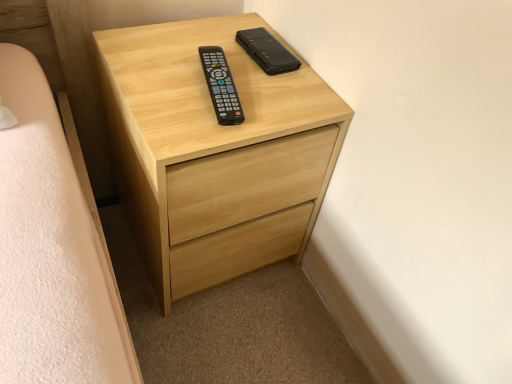
Question: Which direction should I rotate to face black leather phone case at upper center, positioned as the 2th control in front-to-back order, — up or down?

Choices:
 (A) down
 (B) up

Answer: (B)

Question: Is black plastic remote at center, which is counted as the 1th control, starting from the front, next to light wood chest of drawers at center?

Choices:
 (A) yes
 (B) no

Answer: (B)

Question: Can you confirm if black plastic remote at center, the second control viewed from the back, is smaller than light wood chest of drawers at center?

Choices:
 (A) no
 (B) yes

Answer: (B)

Question: From the image's perspective, is black plastic remote at center, which is counted as the 1th control, starting from the front, located above light wood chest of drawers at center?

Choices:
 (A) no
 (B) yes

Answer: (B)

Question: Is light wood chest of drawers at center at the back of black plastic remote at center, which is counted as the 1th control, starting from the front?

Choices:
 (A) yes
 (B) no

Answer: (B)

Question: Is black plastic remote at center, the second control viewed from the back, located outside light wood chest of drawers at center?

Choices:
 (A) yes
 (B) no

Answer: (B)

Question: From the image's perspective, would you say black plastic remote at center, which is counted as the 1th control, starting from the front, is shown under light wood chest of drawers at center?

Choices:
 (A) no
 (B) yes

Answer: (A)

Question: Can you confirm if black plastic remote at center, the second control viewed from the back, is bigger than black leather phone case at upper center, positioned as the 2th control in front-to-back order?

Choices:
 (A) yes
 (B) no

Answer: (A)

Question: From the image's perspective, is black plastic remote at center, which is counted as the 1th control, starting from the front, below black leather phone case at upper center, positioned as the 2th control in front-to-back order?

Choices:
 (A) yes
 (B) no

Answer: (A)

Question: From the image's perspective, is black plastic remote at center, which is counted as the 1th control, starting from the front, on top of black leather phone case at upper center, positioned as the first control in back-to-front order?

Choices:
 (A) yes
 (B) no

Answer: (B)

Question: Considering the relative sizes of black plastic remote at center, the second control viewed from the back, and black leather phone case at upper center, positioned as the first control in back-to-front order, in the image provided, is black plastic remote at center, the second control viewed from the back, thinner than black leather phone case at upper center, positioned as the first control in back-to-front order,?

Choices:
 (A) yes
 (B) no

Answer: (B)

Question: Is the depth of black plastic remote at center, the second control viewed from the back, less than that of black leather phone case at upper center, positioned as the 2th control in front-to-back order?

Choices:
 (A) no
 (B) yes

Answer: (B)

Question: Is black plastic remote at center, which is counted as the 1th control, starting from the front, facing away from black leather phone case at upper center, positioned as the 2th control in front-to-back order?

Choices:
 (A) yes
 (B) no

Answer: (B)

Question: Does black leather phone case at upper center, positioned as the first control in back-to-front order, come behind black plastic remote at center, which is counted as the 1th control, starting from the front?

Choices:
 (A) yes
 (B) no

Answer: (A)